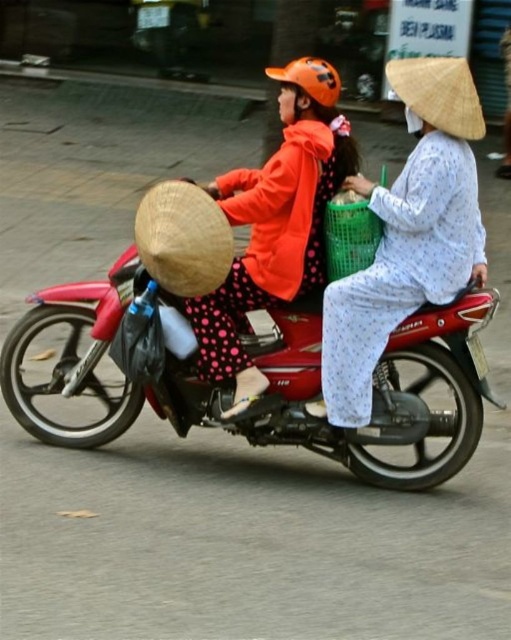
Question: Which object is positioned farthest from the natural straw hat at center?

Choices:
 (A) natural straw hat at upper right
 (B) green woven basket at center

Answer: (A)

Question: Estimate the real-world distances between objects in this image. Which object is farther from the natural straw hat at center?

Choices:
 (A) orange matte helmet at upper center
 (B) red matte motorcycle at center
 (C) green woven basket at center
 (D) matte white conical hat at center

Answer: (D)

Question: Does red matte motorcycle at center lie in front of matte white conical hat at center?

Choices:
 (A) no
 (B) yes

Answer: (B)

Question: Is red matte motorcycle at center above natural straw hat at center?

Choices:
 (A) yes
 (B) no

Answer: (B)

Question: Does orange matte helmet at upper center appear on the right side of green woven basket at center?

Choices:
 (A) no
 (B) yes

Answer: (A)

Question: Which of the following is the farthest from the observer?

Choices:
 (A) (x=206, y=355)
 (B) (x=341, y=369)
 (C) (x=357, y=241)

Answer: (A)